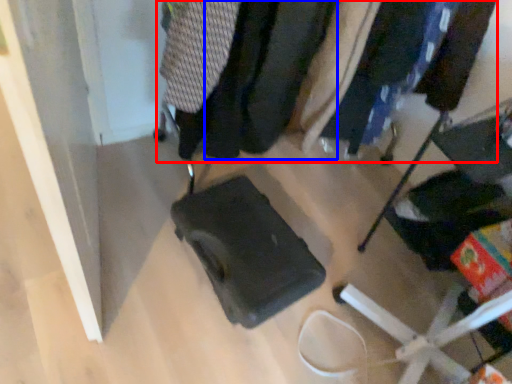
Question: Which object is further to the camera taking this photo, closet (highlighted by a red box) or clothing (highlighted by a blue box)?

Choices:
 (A) closet
 (B) clothing

Answer: (B)